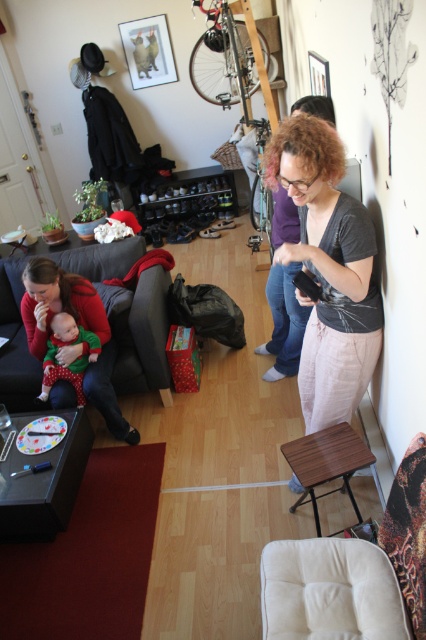
Question: Considering the relative positions of beige fabric armchair at lower right and matte green baby at left in the image provided, where is beige fabric armchair at lower right located with respect to matte green baby at left?

Choices:
 (A) left
 (B) right

Answer: (B)

Question: Can you confirm if matte gray shirt at center is positioned above dark gray fabric couch at lower left?

Choices:
 (A) no
 (B) yes

Answer: (B)

Question: Which of these objects is positioned farthest from the dark gray fabric couch at lower left?

Choices:
 (A) matte green baby at left
 (B) beige fabric armchair at lower right
 (C) matte gray shirt at center

Answer: (B)

Question: Is dark gray fabric couch at lower left positioned behind matte green baby at left?

Choices:
 (A) yes
 (B) no

Answer: (A)

Question: Based on their relative distances, which object is farther from the matte gray shirt at center?

Choices:
 (A) matte green baby at left
 (B) beige fabric armchair at lower right
 (C) dark gray fabric couch at lower left

Answer: (A)

Question: Which object is farther from the camera taking this photo?

Choices:
 (A) matte green baby at left
 (B) matte gray shirt at center
 (C) dark gray fabric couch at lower left

Answer: (C)